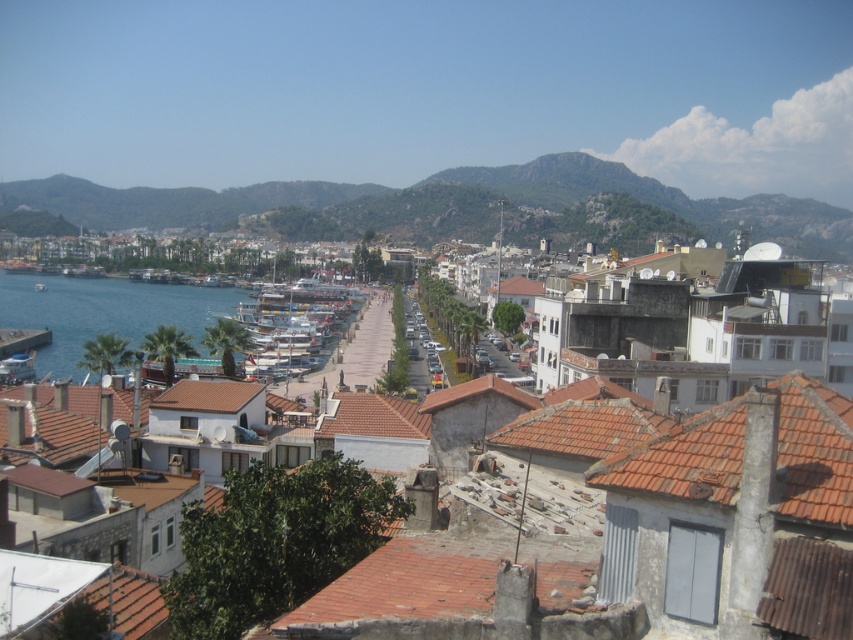
You are a tourist standing at the edge of the marina and want to take a photo that includes both the brown tiled roofs at center and the blue water at lower left. Which object should you frame first to ensure both are visible in the photo?

You should frame the brown tiled roofs at center first since it is smaller than the blue water at lower left, so it requires more attention to include it in the photo.